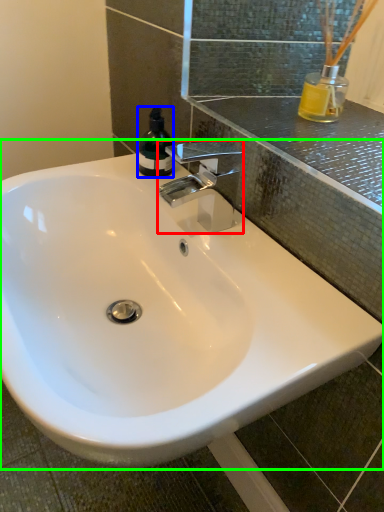
Question: Which object is positioned farthest from tap (highlighted by a red box)? Select from bottle (highlighted by a blue box) and sink (highlighted by a green box).

Choices:
 (A) bottle
 (B) sink

Answer: (B)